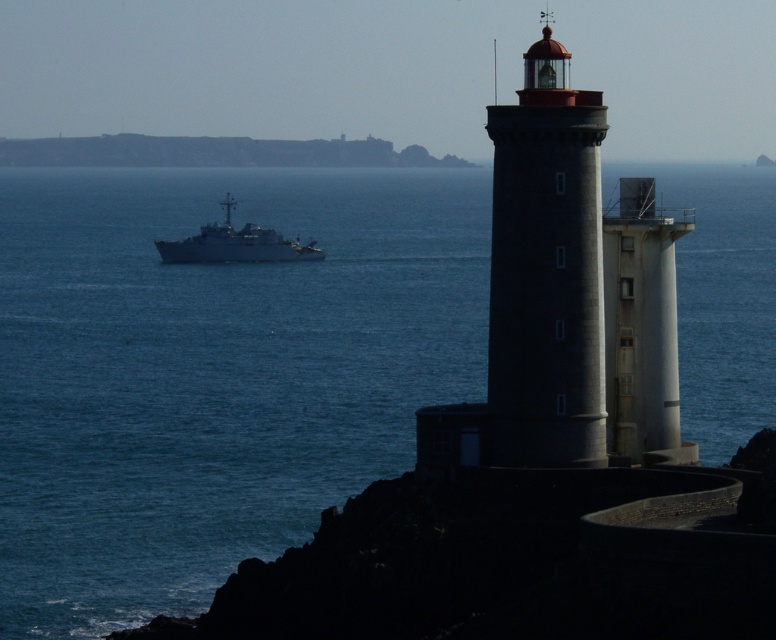
You are a sailor navigating a boat near the coast. You see the white matte ship at center and the blue water at center. Which one is positioned lower in the image?

The blue water at center is positioned below the white matte ship at center, so the blue water at center is lower in the image.

You are standing at the point with coordinates (546, 272) in the coastal scene. What object are you directly facing?

The point at coordinates (546, 272) corresponds to the smooth gray lighthouse at center, so you are directly facing the smooth gray lighthouse at center.